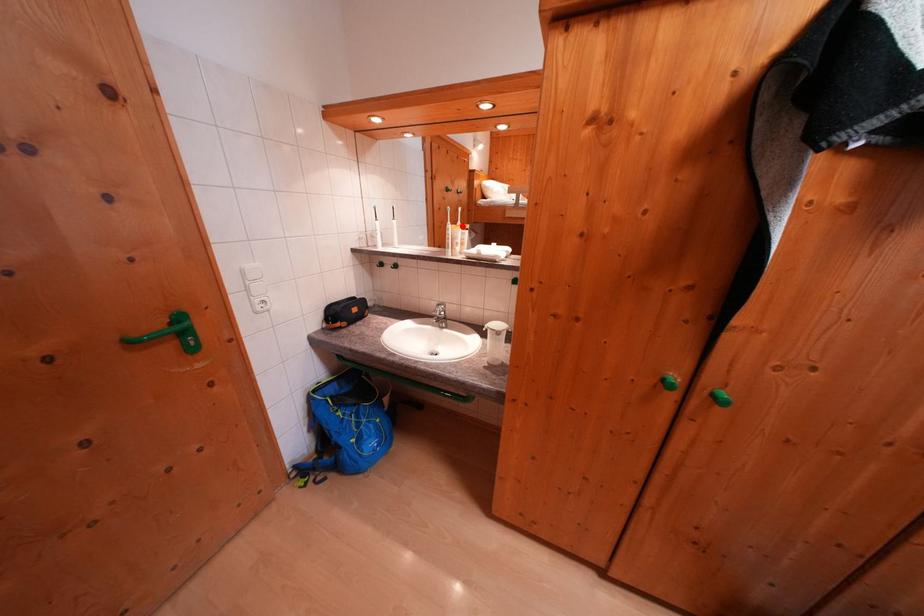
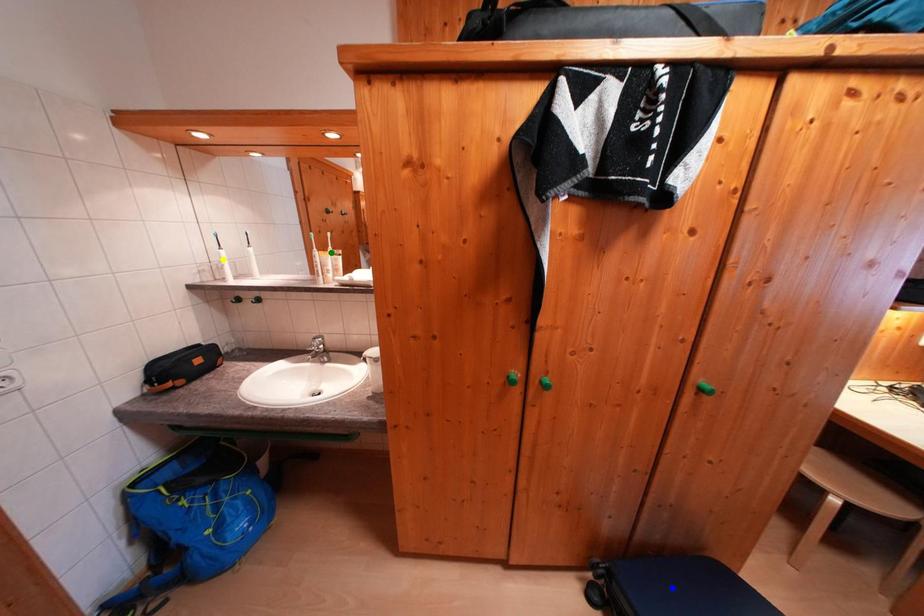
Question: I am providing you with two images of the same scene from different viewpoints. A red point is marked on the first image. You are given multiple points on the second image. Which mark in image 2 goes with the point in image 1?

Choices:
 (A) yellow point
 (B) green point
 (C) blue point

Answer: (B)